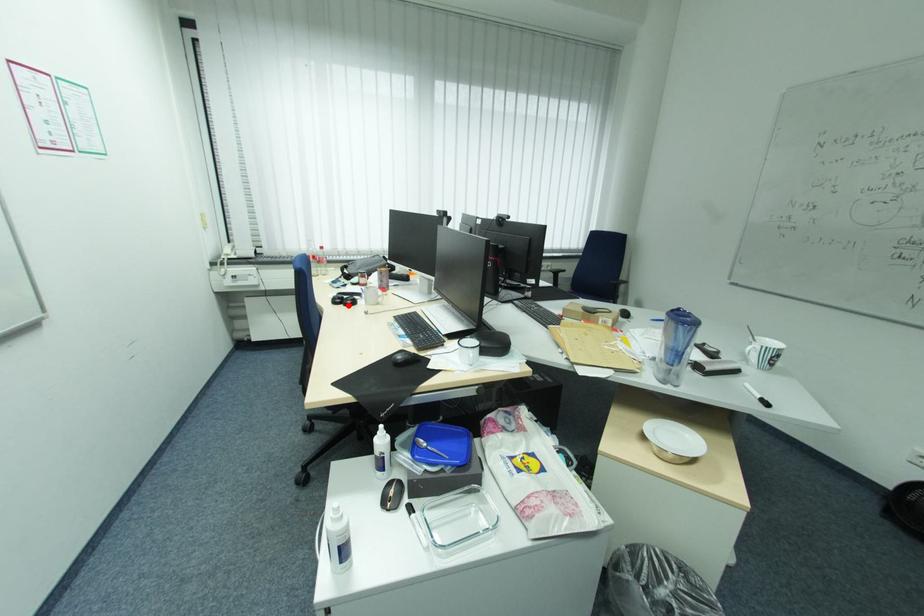
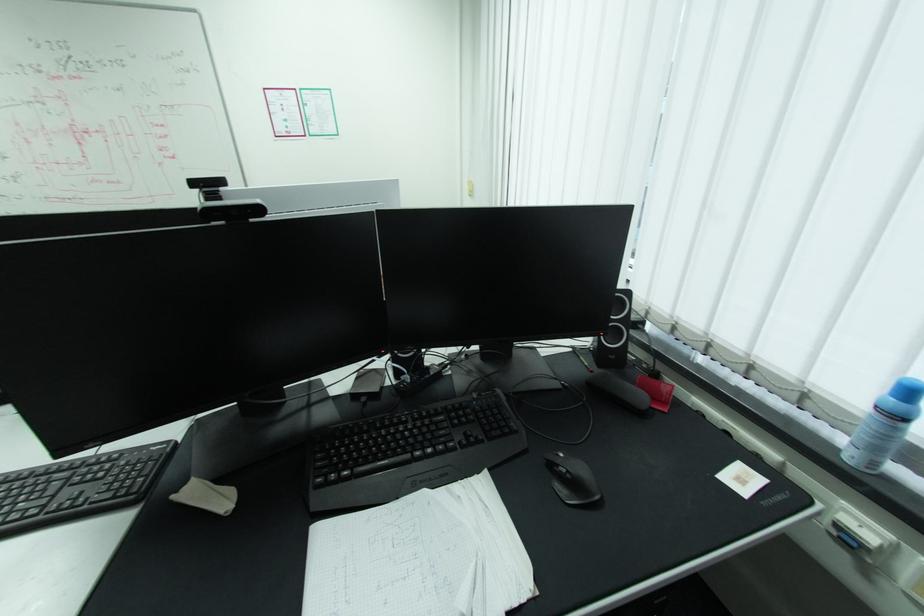
Question: I am providing you with two images of the same scene from different viewpoints. A red point is marked on the first image. Can you still see the location of the red point in image 2?

Choices:
 (A) Yes
 (B) No

Answer: (B)